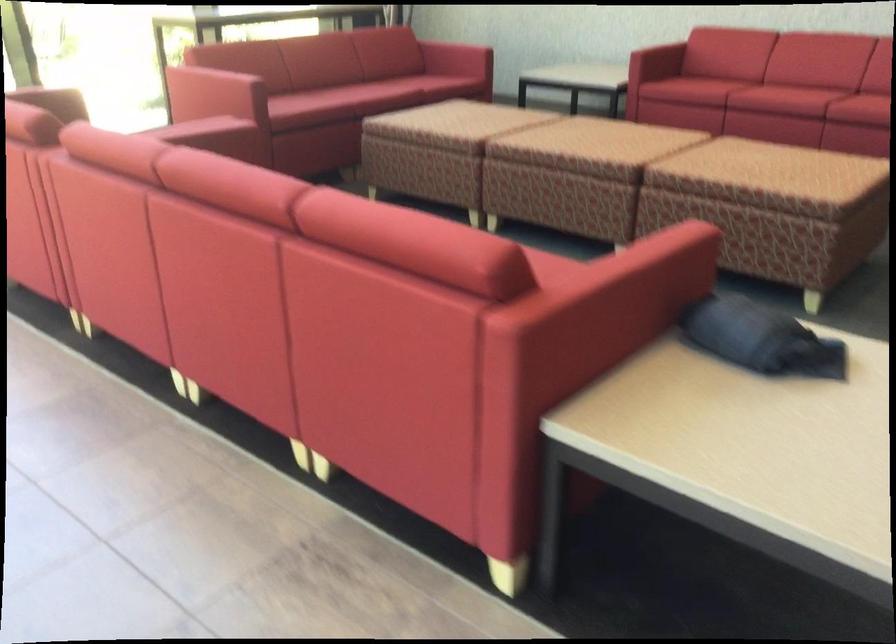
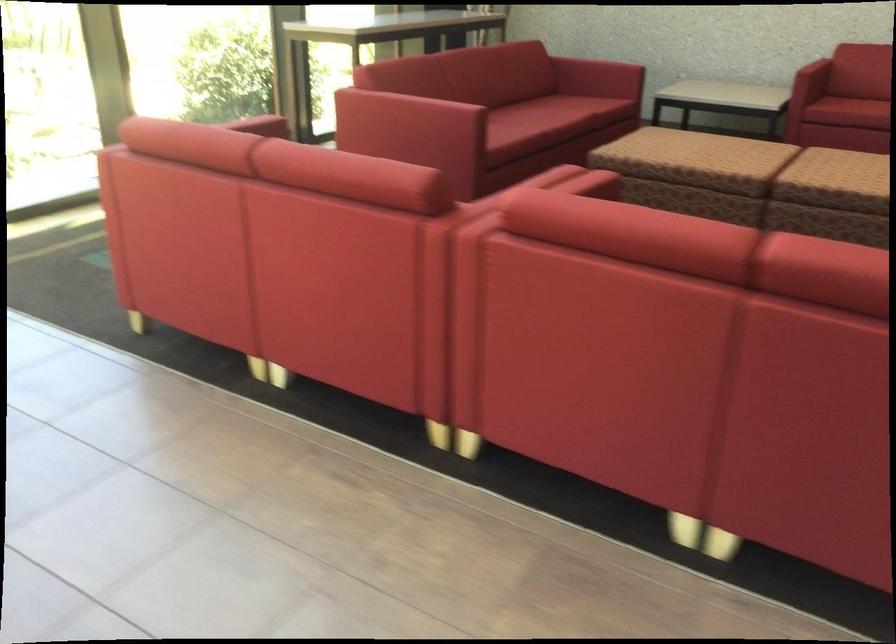
The first image is from the beginning of the video and the second image is from the end. How did the camera likely rotate when shooting the video?

The camera's rotation is toward right-down.